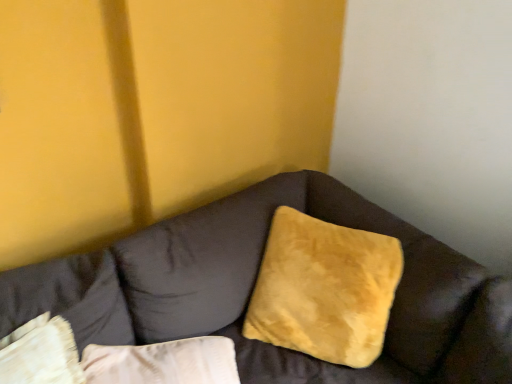
Question: Looking at their shapes, would you say suede-like brown couch at center is wider or thinner than velvet beige pillow at lower left, the 2th pillow viewed from the right?

Choices:
 (A) wide
 (B) thin

Answer: (A)

Question: Considering the positions of point (232, 230) and point (1, 309), is point (232, 230) closer or farther from the camera than point (1, 309)?

Choices:
 (A) farther
 (B) closer

Answer: (A)

Question: Which object is positioned farthest from the velvet beige pillow at lower left, the 2th pillow viewed from the right?

Choices:
 (A) suede-like brown couch at center
 (B) suede yellow pillow at center, which ranks as the second pillow in left-to-right order

Answer: (B)

Question: Which object is the farthest from the suede yellow pillow at center, which ranks as the second pillow in left-to-right order?

Choices:
 (A) velvet beige pillow at lower left, the 2th pillow viewed from the right
 (B) suede-like brown couch at center

Answer: (A)